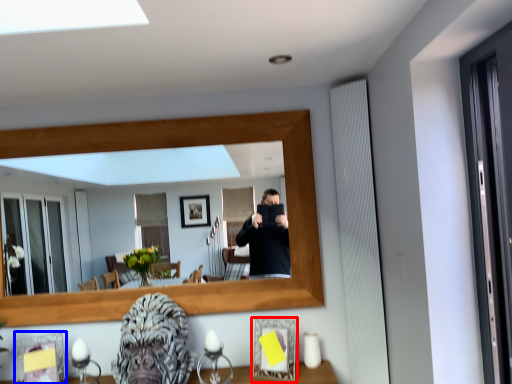
Question: Among these objects, which one is nearest to the camera, picture frame (highlighted by a red box) or picture frame (highlighted by a blue box)?

Choices:
 (A) picture frame
 (B) picture frame

Answer: (A)